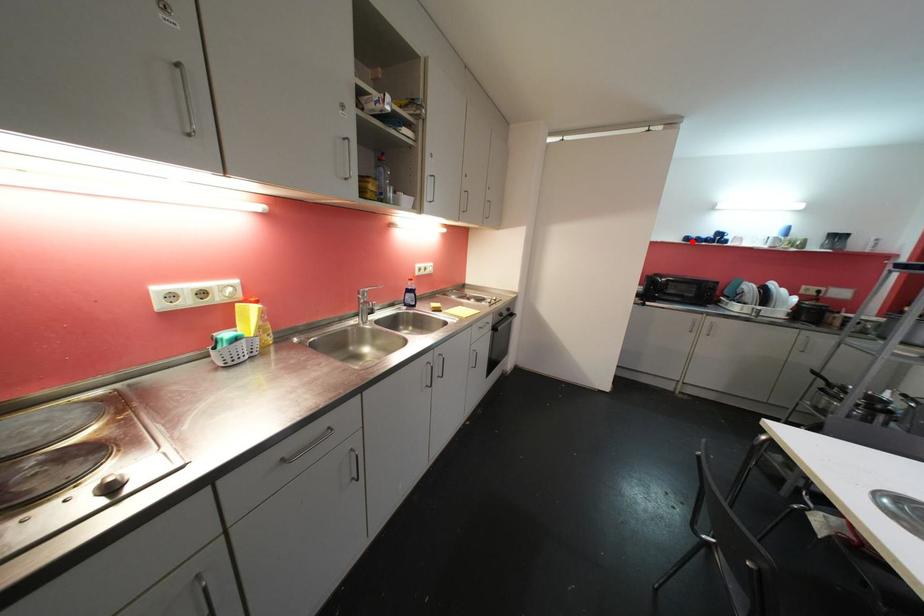
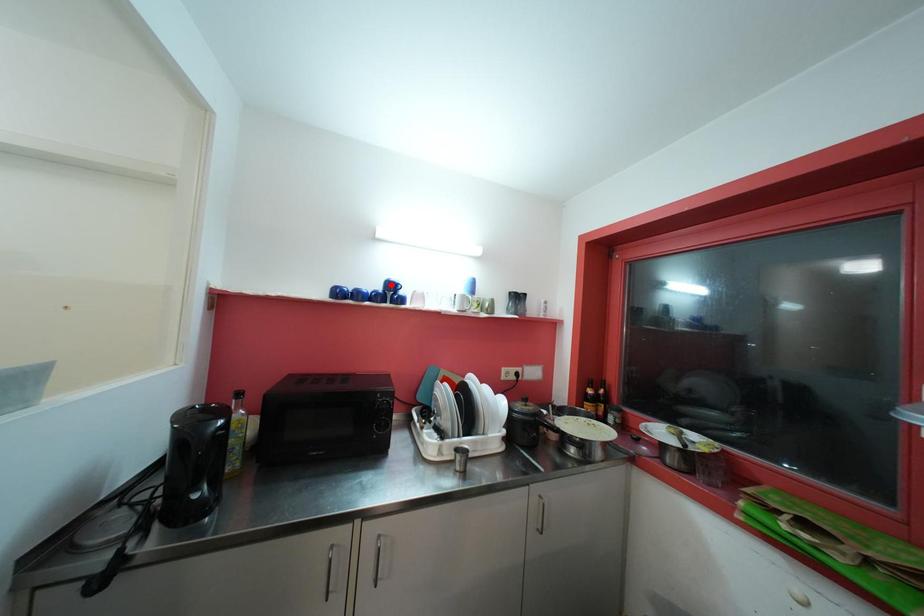
I am providing you with two images of the same scene from different viewpoints. A red point is marked on the first image and another point is marked on the second image. Does the point marked in image1 correspond to the same location as the one in image2?

No